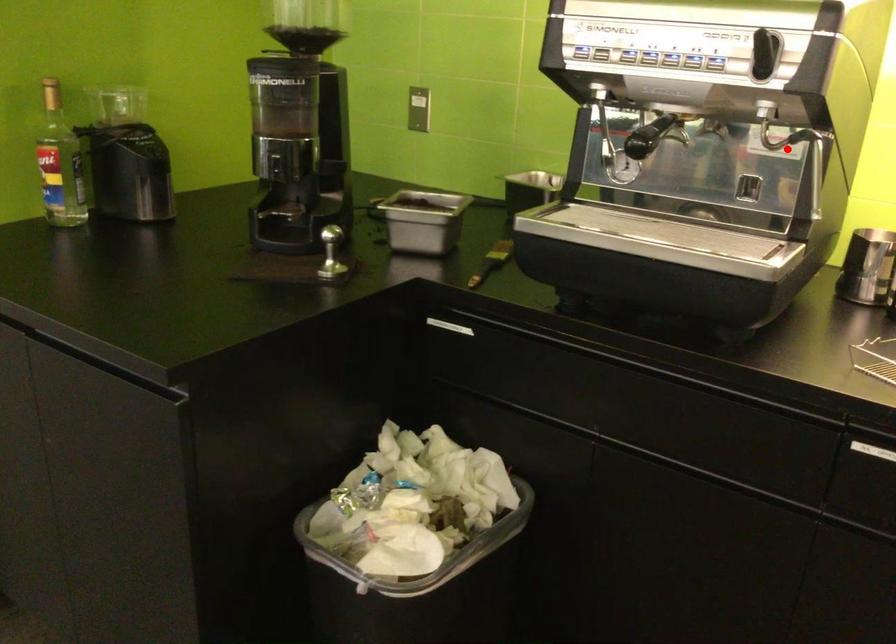
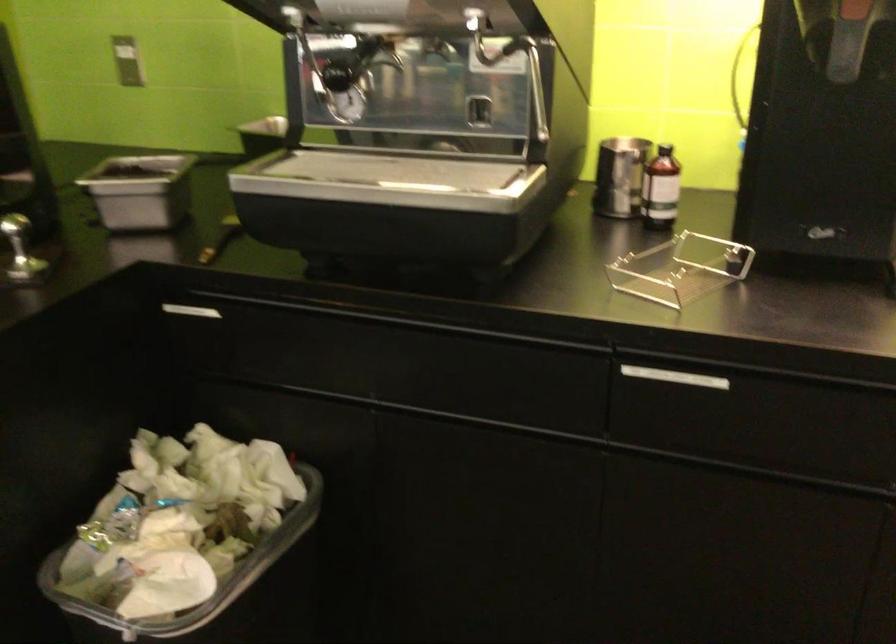
Where in the second image is the point corresponding to the highlighted location from the first image?

(513, 64)